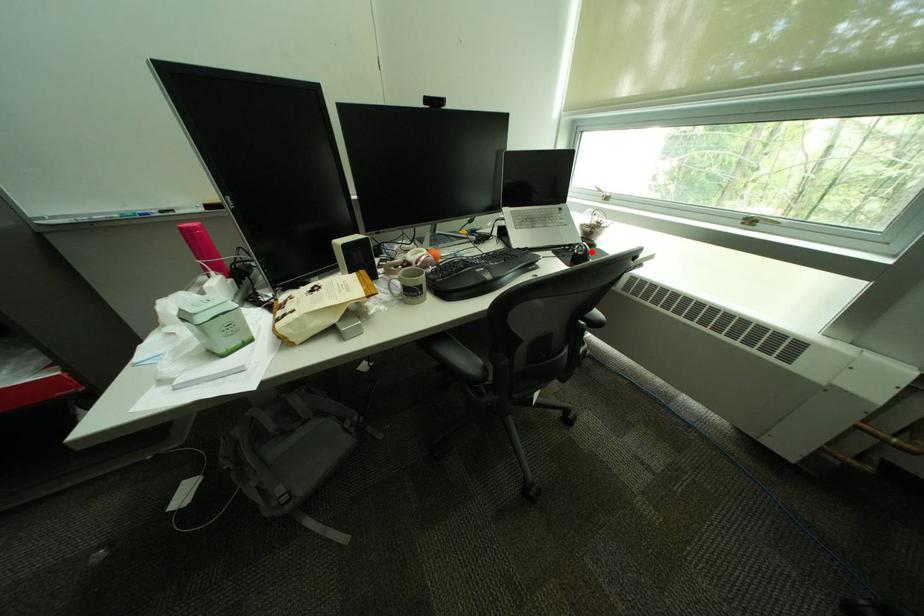
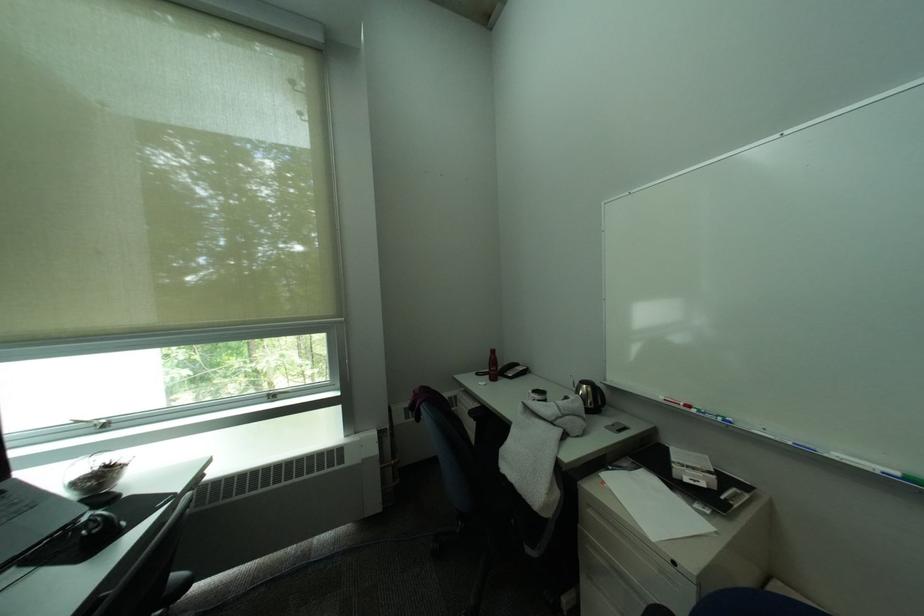
Question: A red point is marked in image1. In image2, is the corresponding 3D point closer to the camera or farther? Reply with the corresponding letter.

Choices:
 (A) The corresponding 3D point is closer.
 (B) The corresponding 3D point is farther.

Answer: (A)